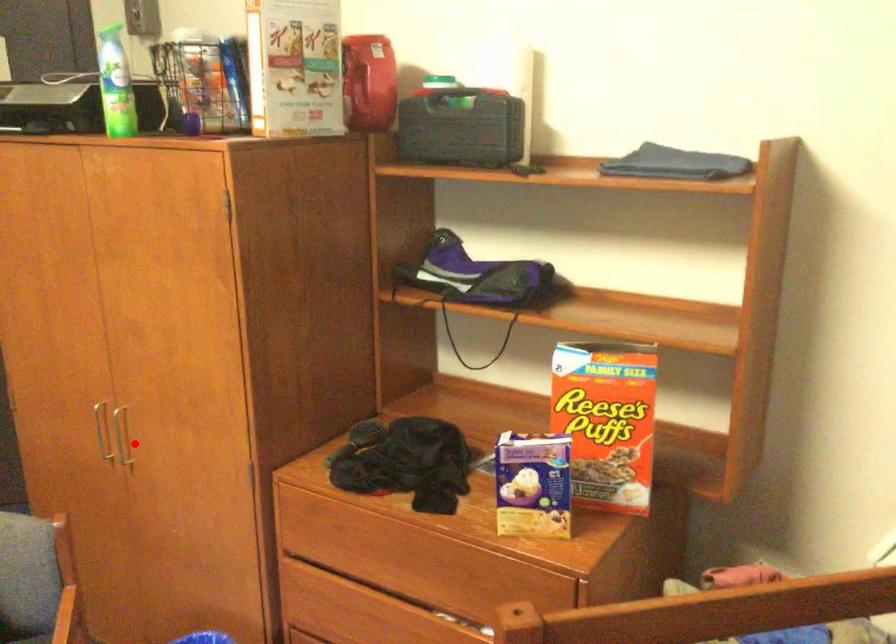
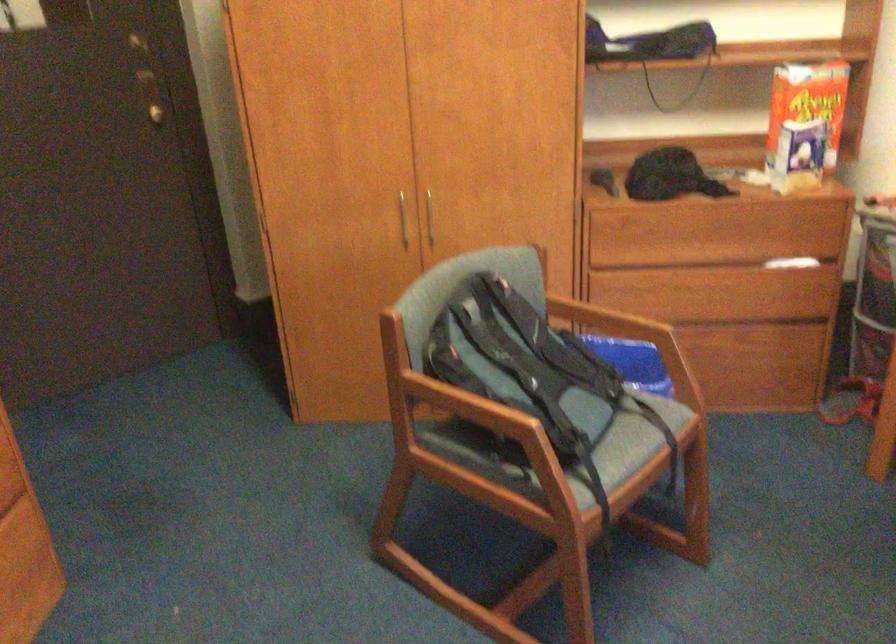
The point at the highlighted location is marked in the first image. Where is the corresponding point in the second image?

(428, 218)